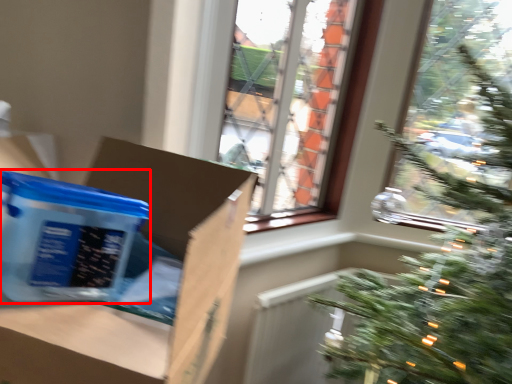
Question: From the image's perspective, where is cardboard box (annotated by the red box) located relative to cardboard box?

Choices:
 (A) above
 (B) below

Answer: (A)